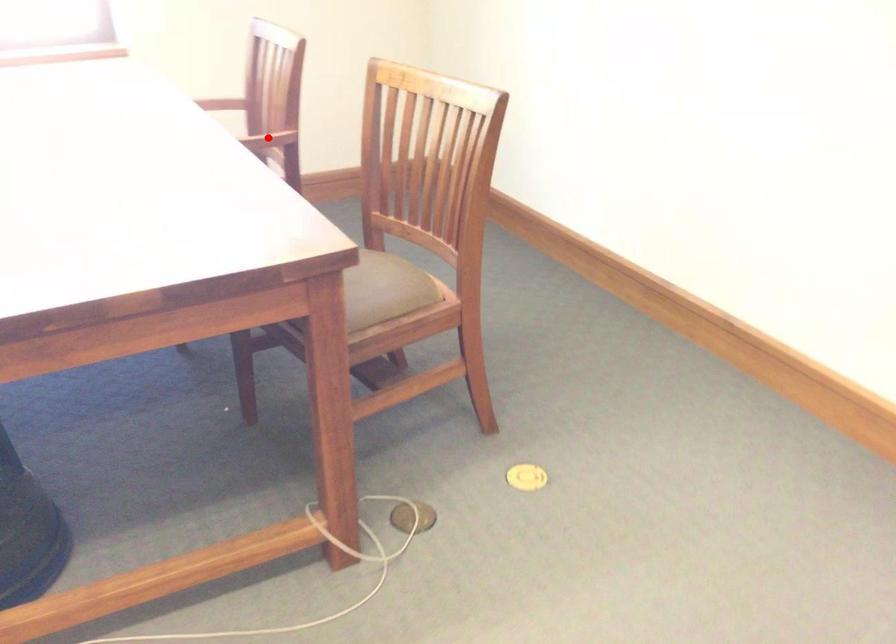
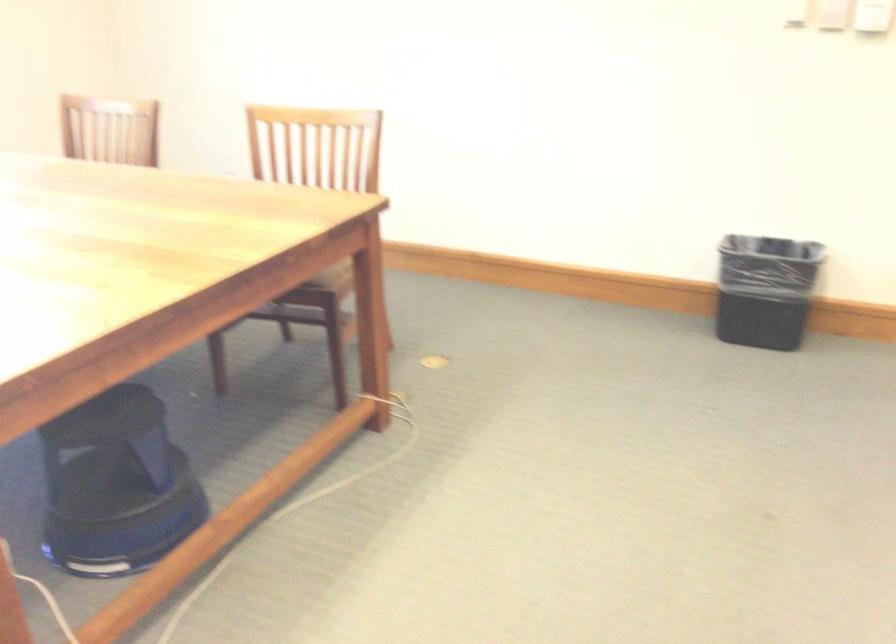
Question: I am providing you with two images of the same scene from different viewpoints. A red point is marked on the first image. At the location where the point appears in image 1, is it still visible in image 2?

Choices:
 (A) Yes
 (B) No

Answer: (B)